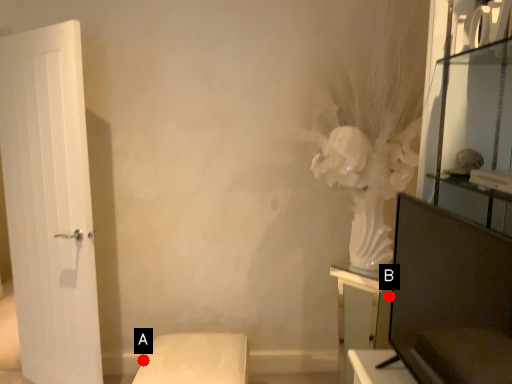
Question: Two points are circled on the image, labeled by A and B beside each circle. Which point is closer to the camera taking this photo?

Choices:
 (A) A is closer
 (B) B is closer

Answer: (B)